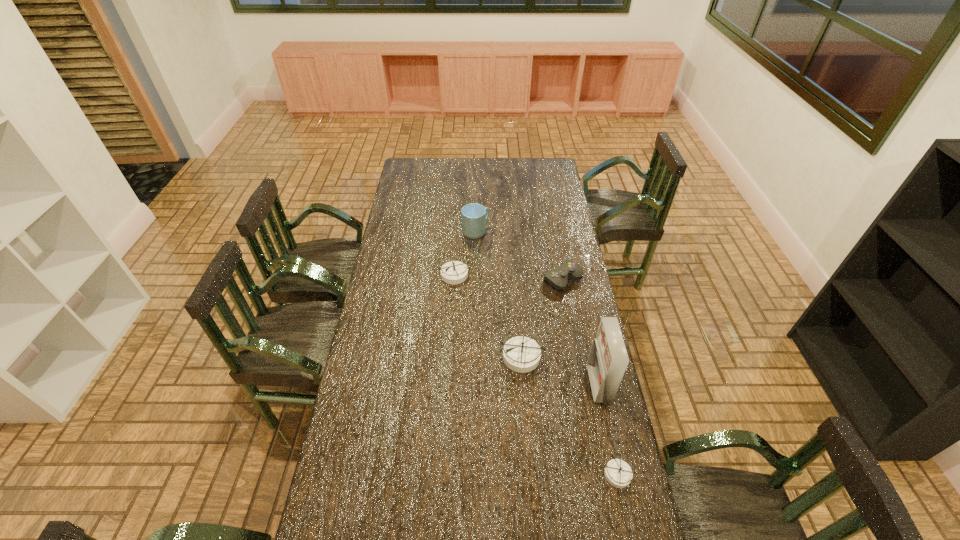
All compasss are currently evenly spaced. To continue this pattern, where would you add another compass on the left? Please point out a vacant spot. Please provide its 2D coordinates. Your answer should be formatted as a tuple, i.e. [(x, y)], where the tuple contains the x and y coordinates of a point satisfying the conditions above.

[(406, 215)]